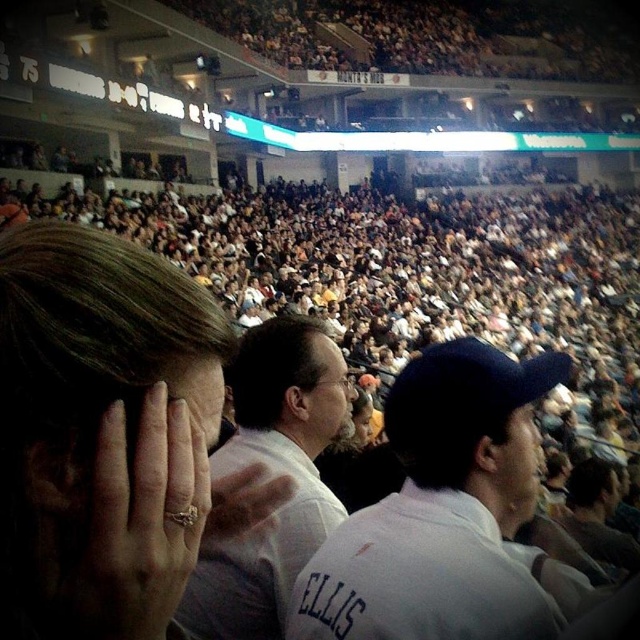
Is point (160, 333) farther from camera compared to point (330, 348)?

That is False.

Who is positioned more to the right, matte gold ring at center or matte black glasses at center?

Positioned to the right is matte black glasses at center.

Between point (273, 499) and point (333, 358), which one is positioned in front?

Point (273, 499) is in front.

Locate an element on the screen. The height and width of the screenshot is (640, 640). matte gold ring at center is located at coordinates (108, 435).

Is white shirt at center closer to camera compared to matte white face at center?

No, it is behind matte white face at center.

Is white shirt at center smaller than matte white face at center?

Actually, white shirt at center might be larger than matte white face at center.

The width and height of the screenshot is (640, 640). In order to click on white shirt at center in this screenshot , I will do `click(273, 472)`.

Locate an element on the screen. The height and width of the screenshot is (640, 640). white shirt at center is located at coordinates (273, 472).

Describe the element at coordinates (108, 435) in the screenshot. I see `matte gold ring at center` at that location.

Looking at this image, can you confirm if matte gold ring at center is positioned to the left of white shirt at center?

Indeed, matte gold ring at center is positioned on the left side of white shirt at center.

What do you see at coordinates (108, 435) in the screenshot? The image size is (640, 640). I see `matte gold ring at center` at bounding box center [108, 435].

Locate an element on the screen. matte gold ring at center is located at coordinates (108, 435).